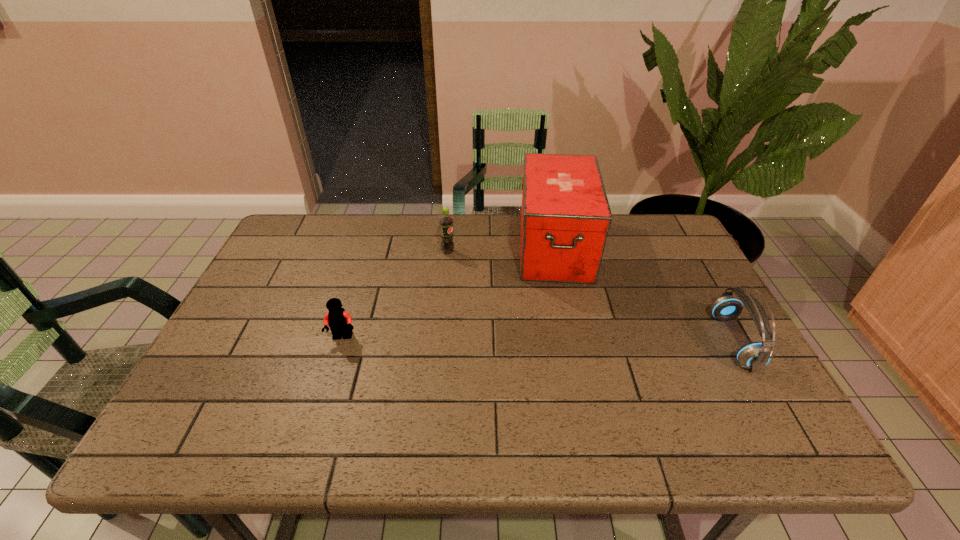
The width and height of the screenshot is (960, 540). I want to click on the shortest object, so click(339, 320).

Image resolution: width=960 pixels, height=540 pixels. I want to click on Lego, so click(339, 320).

The height and width of the screenshot is (540, 960). I want to click on the rightmost object, so click(x=755, y=355).

Locate an element on the screen. Image resolution: width=960 pixels, height=540 pixels. the tallest object is located at coordinates (565, 216).

You are a GUI agent. You are given a task and a screenshot of the screen. Output one action in this format:
    pyautogui.click(x=<x>, y=<y>)
    Task: Click on the first-aid kit
    
    Given the screenshot: What is the action you would take?
    pyautogui.click(x=565, y=216)

Identify the location of the third object from right to left. This screenshot has height=540, width=960. (447, 245).

Locate an element on the screen. The image size is (960, 540). free space located on the front-facing side of the leftmost object is located at coordinates (326, 390).

Where is `free point located 0.300m on the ear cups of the rightmost object`? free point located 0.300m on the ear cups of the rightmost object is located at coordinates (597, 341).

This screenshot has height=540, width=960. Identify the location of vacant space situated 0.320m on the ear cups of the rightmost object. (589, 341).

Identify the location of vacant space situated on the ear cups of the rightmost object. (634, 341).